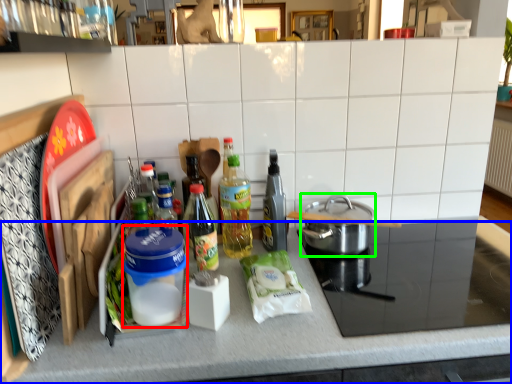
Question: Estimate the real-world distances between objects in this image. Which object is farther from appliance (highlighted by a red box), countertop (highlighted by a blue box) or kitchen appliance (highlighted by a green box)?

Choices:
 (A) countertop
 (B) kitchen appliance

Answer: (B)